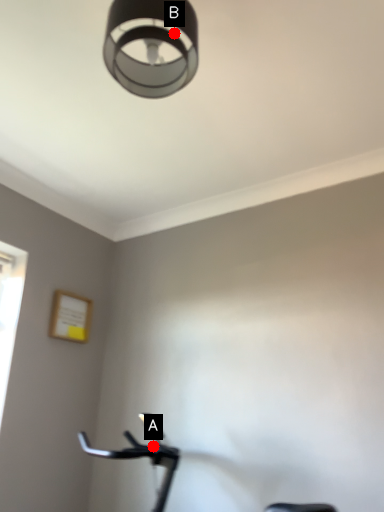
Question: Two points are circled on the image, labeled by A and B beside each circle. Which point is farther to the camera?

Choices:
 (A) A is further
 (B) B is further

Answer: (A)